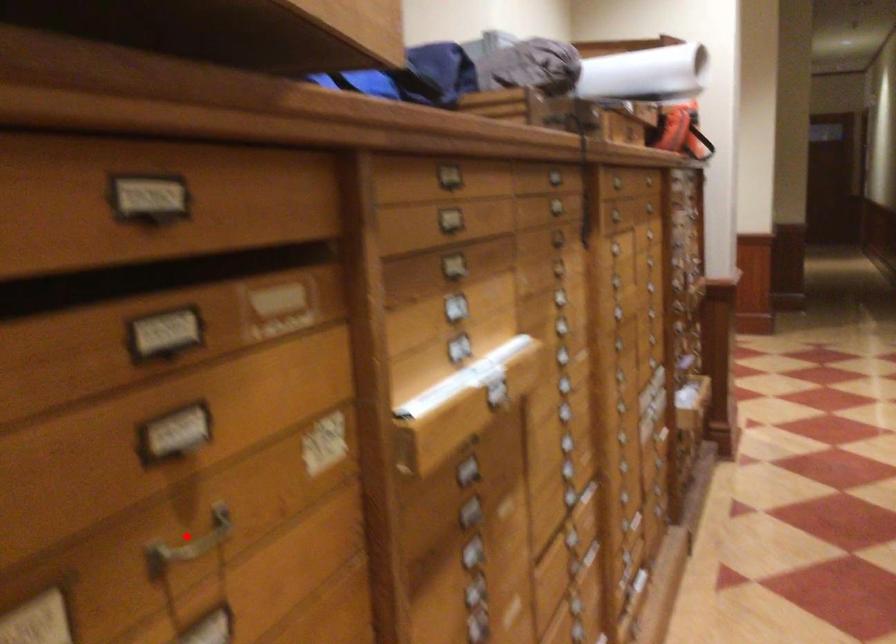
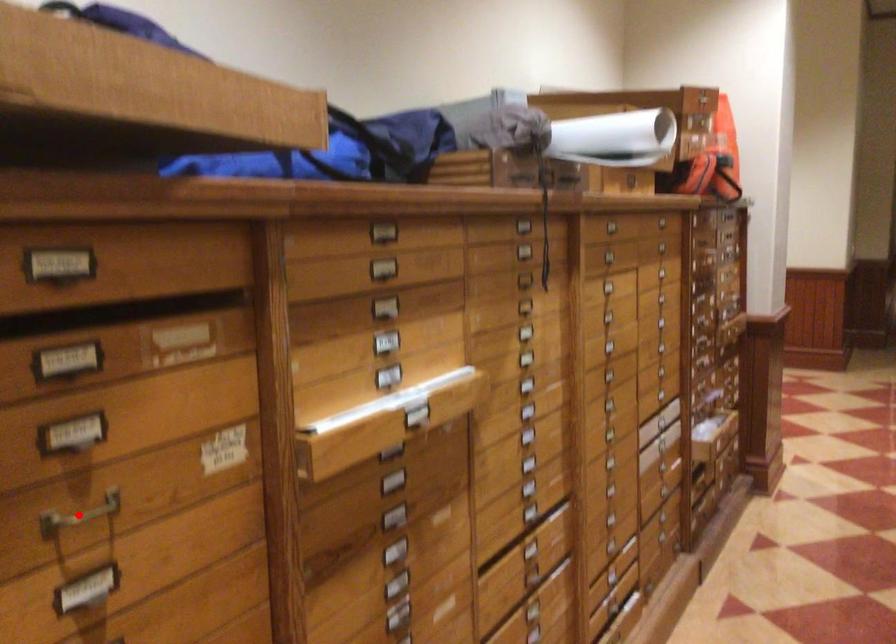
I am providing you with two images of the same scene from different viewpoints. A red point is marked on the first image and another point is marked on the second image. Is the marked point in image1 the same physical position as the marked point in image2?

Yes